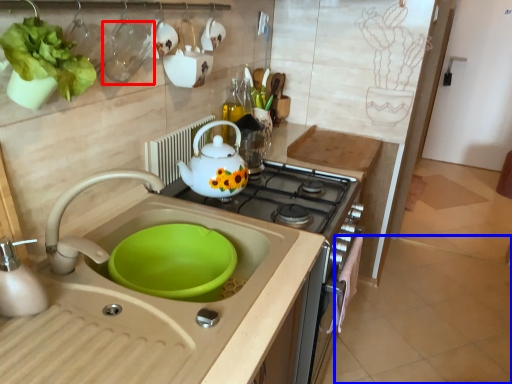
Question: Which object appears farthest to the camera in this image, tableware (highlighted by a red box) or tile (highlighted by a blue box)?

Choices:
 (A) tableware
 (B) tile

Answer: (B)